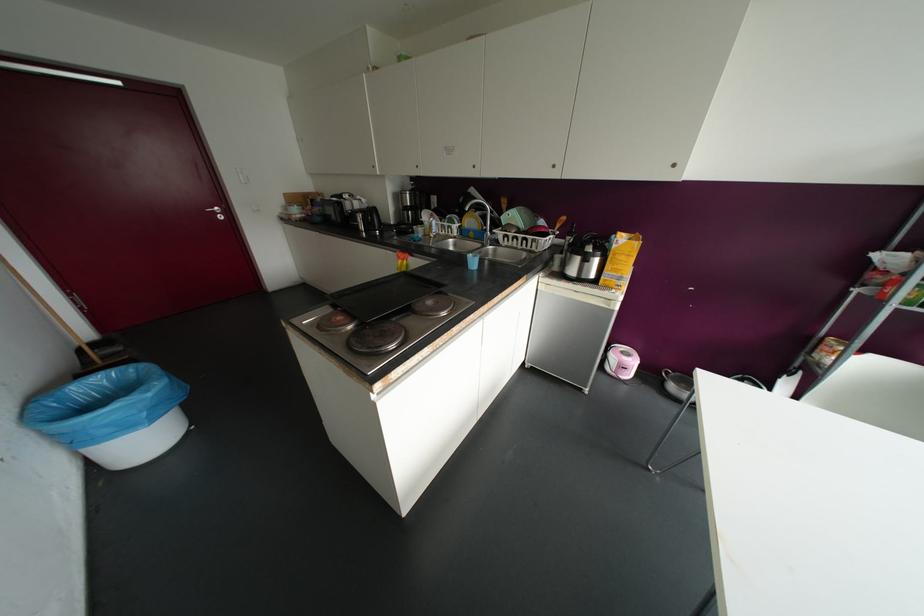
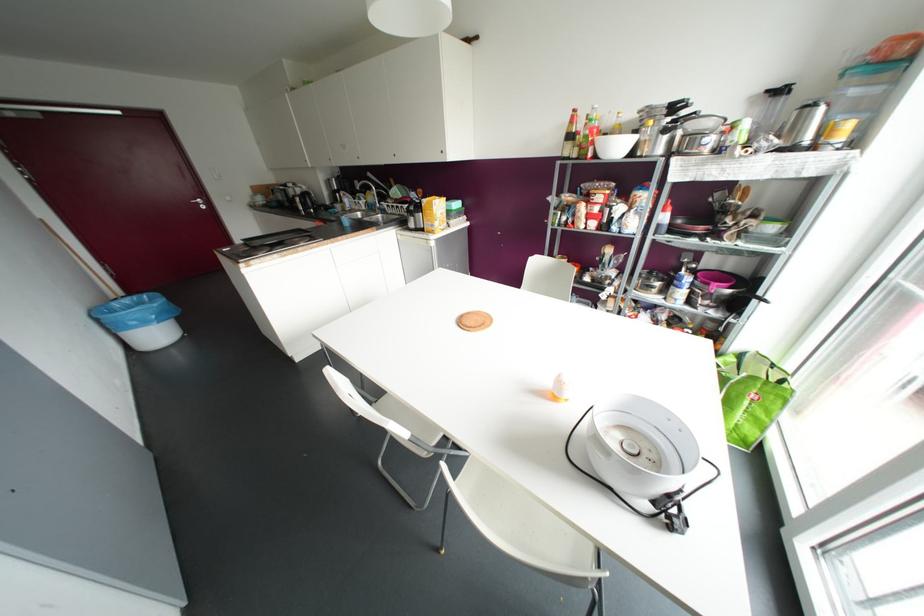
Locate, in the second image, the point that corresponds to pixel 100 379 in the first image.

(127, 300)